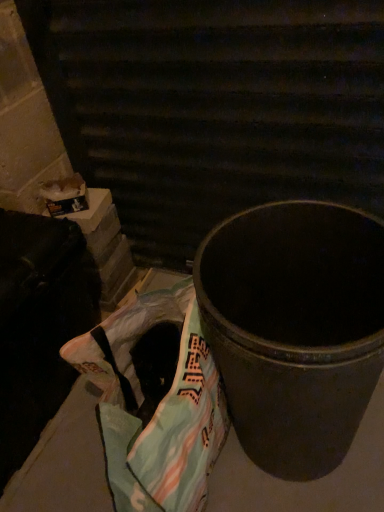
Question: Does metallic trash can at center appear on the right side of plastic grocery bag at lower left?

Choices:
 (A) yes
 (B) no

Answer: (A)

Question: Considering the relative sizes of metallic trash can at center and plastic grocery bag at lower left in the image provided, is metallic trash can at center smaller than plastic grocery bag at lower left?

Choices:
 (A) yes
 (B) no

Answer: (B)

Question: From the image's perspective, does metallic trash can at center appear lower than plastic grocery bag at lower left?

Choices:
 (A) yes
 (B) no

Answer: (B)

Question: From a real-world perspective, is metallic trash can at center positioned under plastic grocery bag at lower left based on gravity?

Choices:
 (A) yes
 (B) no

Answer: (B)

Question: Is metallic trash can at center taller than plastic grocery bag at lower left?

Choices:
 (A) yes
 (B) no

Answer: (A)

Question: Considering the relative positions of metallic trash can at center and plastic grocery bag at lower left in the image provided, is metallic trash can at center to the left of plastic grocery bag at lower left from the viewer's perspective?

Choices:
 (A) no
 (B) yes

Answer: (A)

Question: Is metallic black trash can at center oriented towards metallic trash can at center?

Choices:
 (A) yes
 (B) no

Answer: (A)

Question: From the image's perspective, is metallic black trash can at center below metallic trash can at center?

Choices:
 (A) no
 (B) yes

Answer: (A)

Question: Is the position of metallic black trash can at center less distant than that of metallic trash can at center?

Choices:
 (A) yes
 (B) no

Answer: (B)

Question: Can you confirm if metallic black trash can at center is wider than metallic trash can at center?

Choices:
 (A) no
 (B) yes

Answer: (A)

Question: From the image's perspective, does metallic black trash can at center appear higher than metallic trash can at center?

Choices:
 (A) yes
 (B) no

Answer: (A)

Question: Is metallic black trash can at center shorter than metallic trash can at center?

Choices:
 (A) no
 (B) yes

Answer: (A)

Question: Considering the relative positions of plastic grocery bag at lower left and metallic trash can at center in the image provided, is plastic grocery bag at lower left to the right of metallic trash can at center from the viewer's perspective?

Choices:
 (A) no
 (B) yes

Answer: (A)